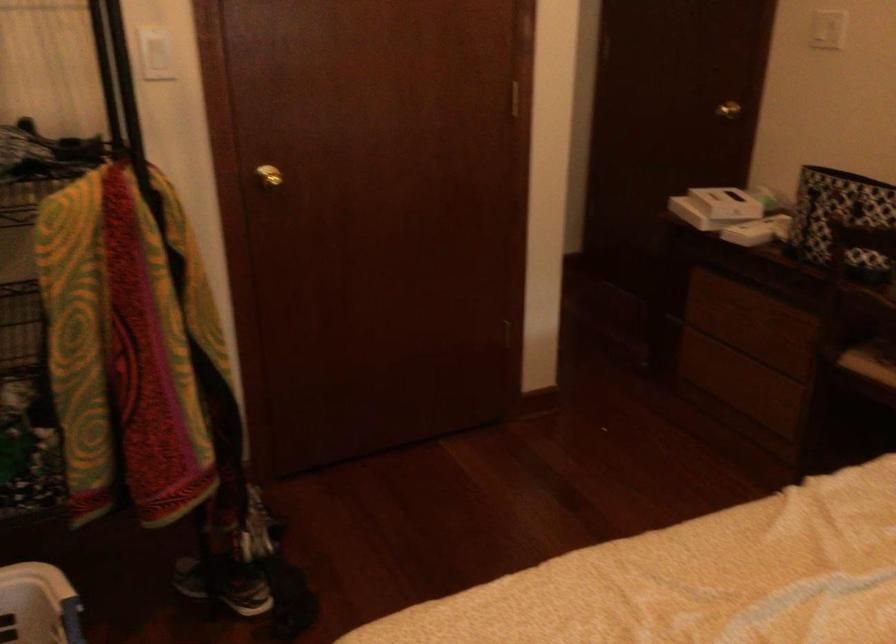
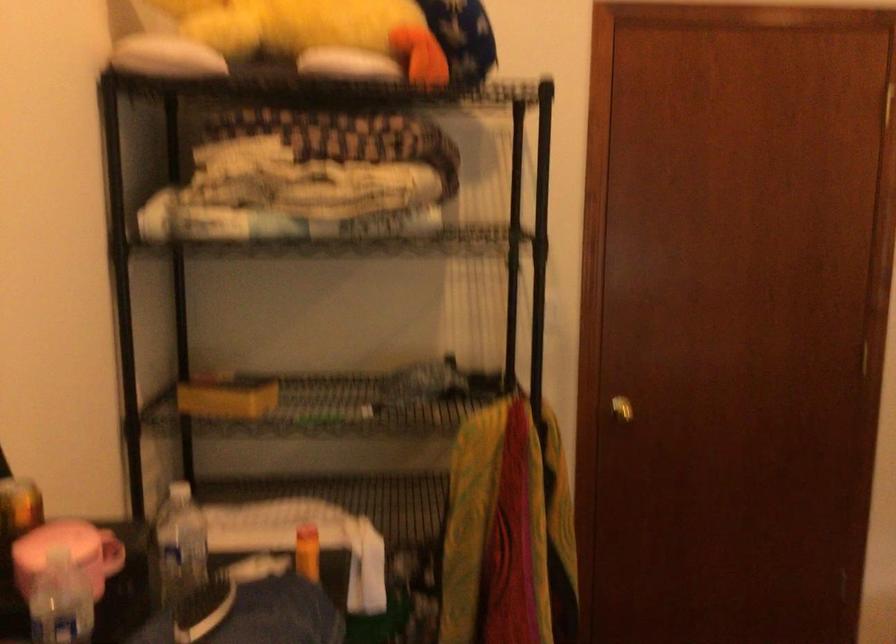
Question: The camera is either moving clockwise (left) or counter-clockwise (right) around the object. The first image is from the beginning of the video and the second image is from the end. Is the camera moving left or right when shooting the video?

Choices:
 (A) Left
 (B) Right

Answer: (B)